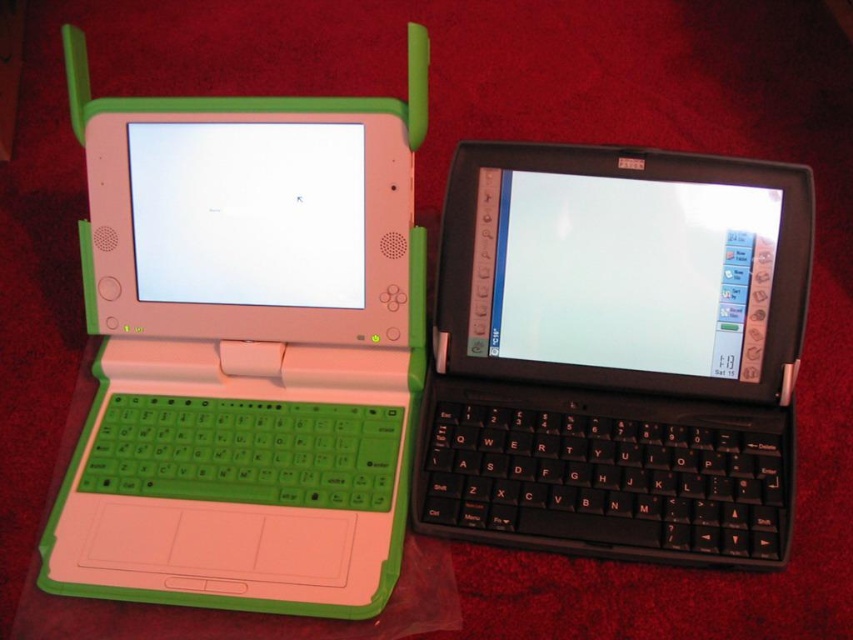
Consider the image. You are setting up a desk and want to place a new keyboard between the green matte laptop at left and the black matte keyboard at center. Based on their positions, can the new keyboard fit horizontally between them?

The green matte laptop at left is located above the black matte keyboard at center, so they are positioned vertically rather than horizontally. Therefore, placing a new keyboard between them horizontally would not be possible as they are stacked vertically.

You are organizing a tech event and need to arrange the green matte laptop at left and the black matte keyboard at center on a table. If you want to place them in the order they appear from left to right, which object should be placed first?

The green matte laptop at left should be placed first since it is positioned on the left side of the black matte keyboard at center.